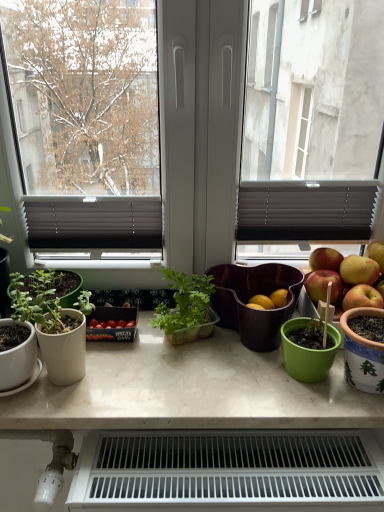
Locate an element on the screen. The image size is (384, 512). vacant space that is in between matte white pot at left, which is the 2th houseplant from right to left, and christmas-patterned ceramic pot at right is located at coordinates tap(201, 379).